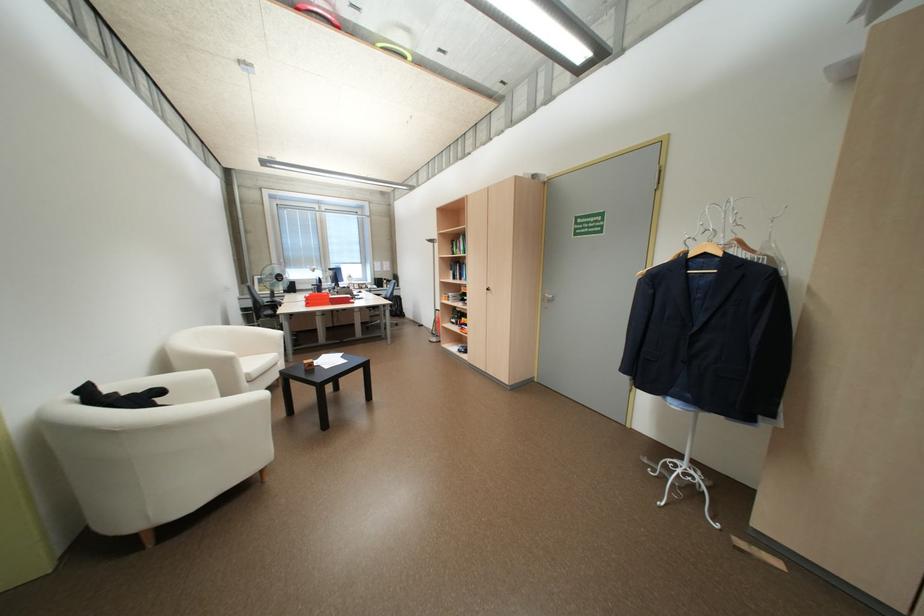
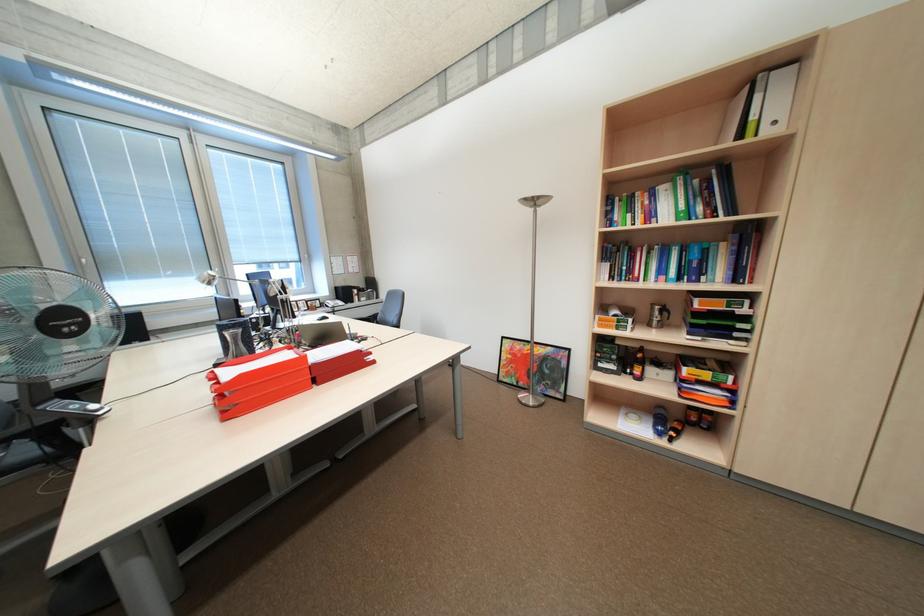
Which direction would the cameraman need to move to produce the second image?

The cameraman walked toward left, forward.